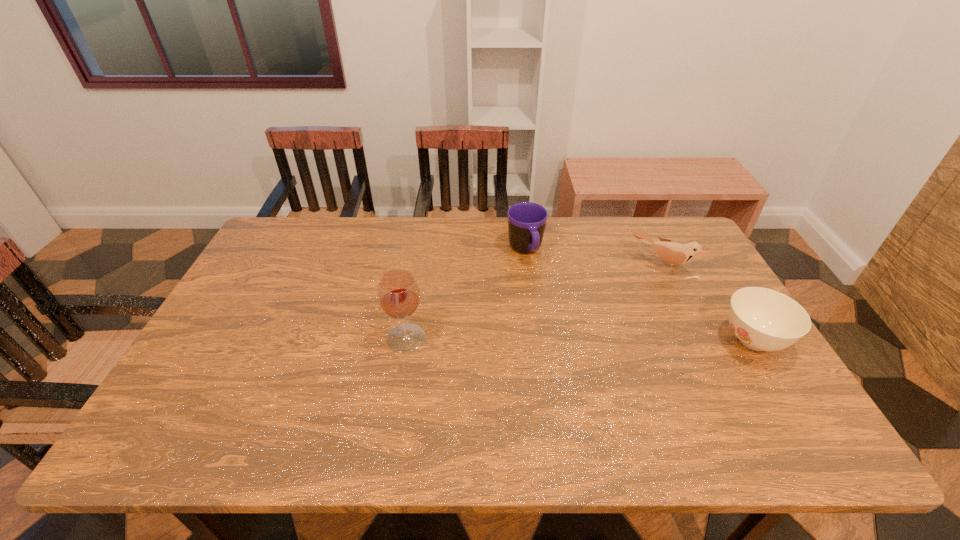
Find the location of a particular element. Image resolution: width=960 pixels, height=540 pixels. free region located with the handle on the side of the mug is located at coordinates (544, 297).

Identify the location of blank space located with the handle on the side of the mug. This screenshot has height=540, width=960. (538, 282).

Find the location of a particular element. vacant space located 0.210m with the handle on the side of the mug is located at coordinates (551, 314).

You are a GUI agent. You are given a task and a screenshot of the screen. Output one action in this format:
    pyautogui.click(x=<x>, y=<y>)
    Task: Click on the bird located in the far edge section of the desktop
    The width and height of the screenshot is (960, 540).
    Given the screenshot: What is the action you would take?
    pyautogui.click(x=673, y=253)

The image size is (960, 540). What are the coordinates of `mug located in the far edge section of the desktop` in the screenshot? It's located at (527, 222).

You are a GUI agent. You are given a task and a screenshot of the screen. Output one action in this format:
    pyautogui.click(x=<x>, y=<y>)
    Task: Click on the sugar bowl present at the right edge
    
    Given the screenshot: What is the action you would take?
    pyautogui.click(x=762, y=319)

The image size is (960, 540). In order to click on bird that is positioned at the right edge in this screenshot , I will do `click(673, 253)`.

The image size is (960, 540). Identify the location of object that is at the far right corner. 673,253.

You are a GUI agent. You are given a task and a screenshot of the screen. Output one action in this format:
    pyautogui.click(x=<x>, y=<y>)
    Task: Click on the free location at the far edge
    
    Given the screenshot: What is the action you would take?
    pyautogui.click(x=581, y=234)

Find the location of a particular element. The height and width of the screenshot is (540, 960). blank space at the near edge is located at coordinates (267, 402).